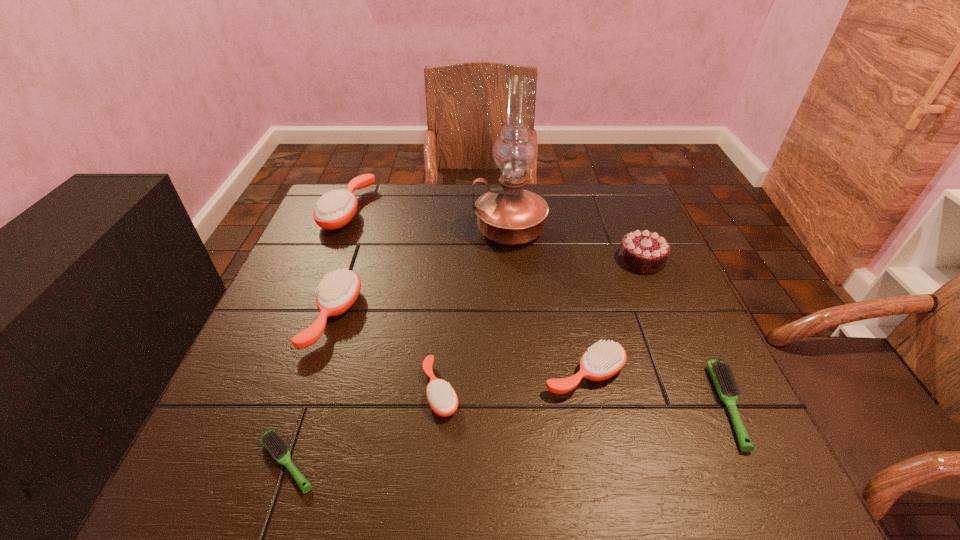
Locate an element on the screen. vacant space located 0.340m on the back of the second shortest object is located at coordinates (660, 257).

Where is `vacant point located 0.210m on the back of the shortest object`? vacant point located 0.210m on the back of the shortest object is located at coordinates (327, 340).

The width and height of the screenshot is (960, 540). I want to click on oil lamp present at the far edge, so click(509, 215).

This screenshot has width=960, height=540. Find the location of `hairbrush that is at the far edge`. hairbrush that is at the far edge is located at coordinates (334, 210).

Where is `chocolate cake present at the right edge`? This screenshot has width=960, height=540. chocolate cake present at the right edge is located at coordinates (645, 252).

In order to click on hairbrush positioned at the right edge in this screenshot , I will do `click(722, 375)`.

Identify the location of object present at the far left corner. (334, 210).

Locate an element on the screen. object that is at the near left corner is located at coordinates 272,441.

This screenshot has height=540, width=960. What are the coordinates of `object situated at the near right corner` in the screenshot? It's located at (722, 375).

Where is `free space at the far edge of the desktop`? The width and height of the screenshot is (960, 540). free space at the far edge of the desktop is located at coordinates (569, 219).